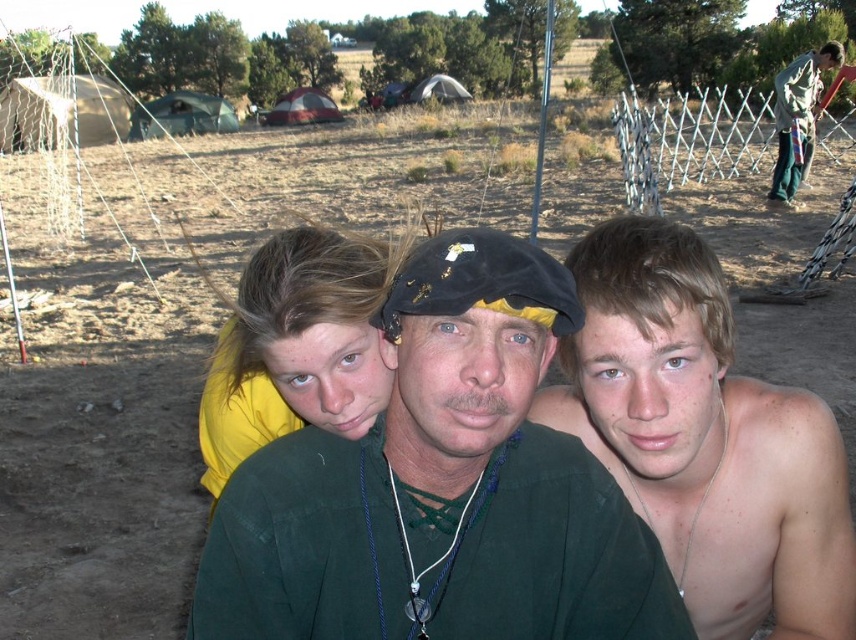
You are a photographer trying to capture a clear photo of the green fabric shirt at center and the green fabric pants at right. However, you notice that one of them is blocking the other. Which one is blocking the other?

The green fabric shirt at center is blocking the green fabric pants at right because it is positioned in front of it.

You are planning to take a photo of the scene. The camera can only focus on objects that take up more than half the frame. Based on the description, which object between the green fabric shirt at center and the shiny silver necklace at center would the camera focus on?

The shiny silver necklace at center occupies more space than the green fabric shirt at center, so the camera would focus on the shiny silver necklace at center.